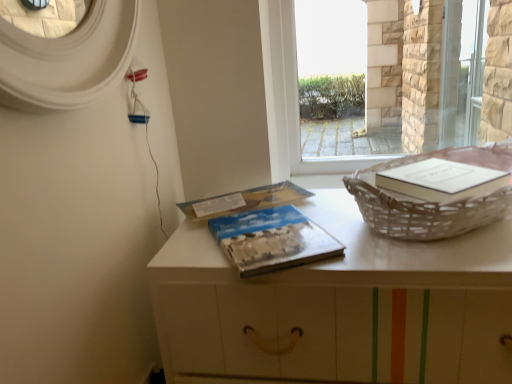
I want to click on free location to the right of blue textured paper at center, marked as the 1th paperback book in a front-to-back arrangement, so click(x=372, y=239).